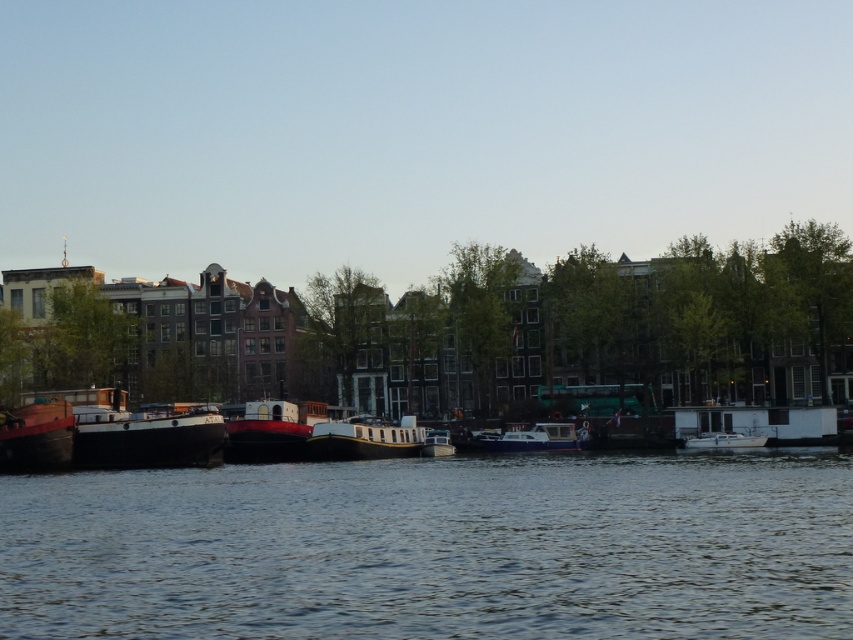
Question: Which object is positioned closest to the smooth water at center?

Choices:
 (A) white matte boat at center
 (B) white matte boat at left
 (C) matte red boat at left

Answer: (B)

Question: Is smooth water at center behind metallic red boat at center?

Choices:
 (A) yes
 (B) no

Answer: (B)

Question: Which object is closer to the camera taking this photo?

Choices:
 (A) metallic red boat at center
 (B) white matte boat at left
 (C) matte red boat at left

Answer: (C)

Question: Which of the following is the farthest from the observer?

Choices:
 (A) matte red boat at left
 (B) white glossy boat at center

Answer: (B)

Question: Is smooth water at center wider than white matte boat at left?

Choices:
 (A) yes
 (B) no

Answer: (A)

Question: In this image, where is white matte boat at left located relative to black matte boat at center?

Choices:
 (A) right
 (B) left

Answer: (B)